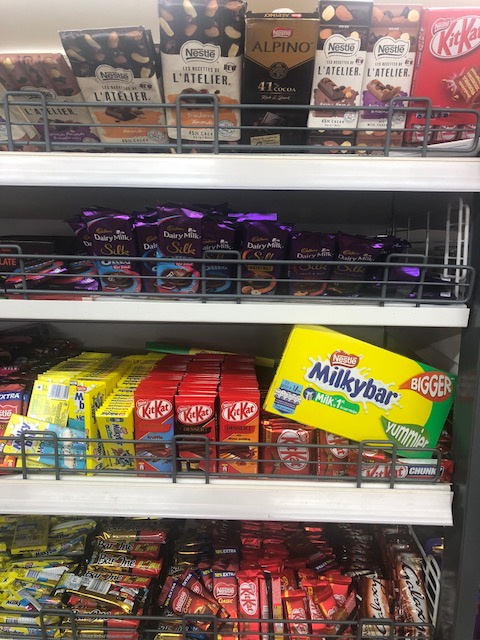
Locate an element on the screen. wire rack is located at coordinates (212, 619), (204, 467), (198, 290), (215, 145).